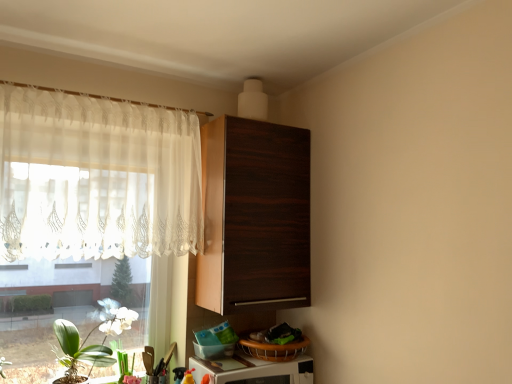
This screenshot has height=384, width=512. What do you see at coordinates (254, 217) in the screenshot?
I see `dark wood cabinet at upper center` at bounding box center [254, 217].

Where is `dark wood cabinet at upper center`? dark wood cabinet at upper center is located at coordinates (254, 217).

What is the approximate width of white glossy microwave at lower center?

13.50 inches.

Describe the element at coordinates (122, 361) in the screenshot. I see `green matte plant at lower left` at that location.

The width and height of the screenshot is (512, 384). In order to click on dark wood cabinet at upper center in this screenshot , I will do `click(254, 217)`.

From the image's perspective, which is above, sheer white curtain at left or white glossy microwave at lower center?

sheer white curtain at left, from the image's perspective.

Is point (42, 160) less distant than point (240, 375)?

Yes, point (42, 160) is closer to viewer.

Choose the correct answer: Is sheer white curtain at left inside white glossy microwave at lower center or outside it?

sheer white curtain at left lies outside white glossy microwave at lower center.

Between sheer white curtain at left and white glossy microwave at lower center, which one is positioned in front?

Result: Positioned in front is sheer white curtain at left.

At what (x,y) coordinates should I click in order to perform the action: click on houseplant located below the sheer white curtain at left (from the image's perspective). Please return your answer as a coordinate pair (x, y). Looking at the image, I should click on (78, 353).

From a real-world perspective, is green leafy plant at lower left below sheer white curtain at left?

Correct, in the physical world, green leafy plant at lower left is lower than sheer white curtain at left.

Could you tell me if green leafy plant at lower left is turned towards sheer white curtain at left?

No, green leafy plant at lower left is not aimed at sheer white curtain at left.

Is point (229, 133) closer or farther from the camera than point (120, 344)?

Point (229, 133) is closer to the camera than point (120, 344).

Is dark wood cabinet at upper center to the left or to the right of green matte plant at lower left in the image?

Based on their positions, dark wood cabinet at upper center is located to the right of green matte plant at lower left.

Can you tell me how much dark wood cabinet at upper center and green matte plant at lower left differ in facing direction?

The facing directions of dark wood cabinet at upper center and green matte plant at lower left are 2.72 degrees apart.

Is dark wood cabinet at upper center situated inside green matte plant at lower left or outside?

dark wood cabinet at upper center is located beyond the bounds of green matte plant at lower left.

Does point (305, 377) lie behind point (247, 216)?

That is True.

Which of these two, white glossy microwave at lower center or dark wood cabinet at upper center, stands taller?

dark wood cabinet at upper center is taller.

Is white glossy microwave at lower center situated inside dark wood cabinet at upper center or outside?

white glossy microwave at lower center cannot be found inside dark wood cabinet at upper center.

Is white glossy microwave at lower center placed right next to dark wood cabinet at upper center?

white glossy microwave at lower center is not next to dark wood cabinet at upper center, and they're not touching.

Looking at the image, does sheer white curtain at left seem bigger or smaller compared to dark wood cabinet at upper center?

Considering their sizes, sheer white curtain at left takes up less space than dark wood cabinet at upper center.

From a real-world perspective, who is located lower, sheer white curtain at left or dark wood cabinet at upper center?

dark wood cabinet at upper center.

Which of these two, sheer white curtain at left or dark wood cabinet at upper center, stands taller?

dark wood cabinet at upper center.

Is dark wood cabinet at upper center smaller than sheer white curtain at left?

Incorrect, dark wood cabinet at upper center is not smaller in size than sheer white curtain at left.

Does dark wood cabinet at upper center have a lesser width compared to sheer white curtain at left?

No, dark wood cabinet at upper center is not thinner than sheer white curtain at left.

Where is `curtain on the left of dark wood cabinet at upper center`? This screenshot has width=512, height=384. curtain on the left of dark wood cabinet at upper center is located at coordinates (96, 177).

Is dark wood cabinet at upper center oriented away from sheer white curtain at left?

No.

Is green matte plant at lower left in front of or behind sheer white curtain at left in the image?

green matte plant at lower left is positioned farther from the viewer than sheer white curtain at left.

Is green matte plant at lower left placed right next to sheer white curtain at left?

No, green matte plant at lower left is not making contact with sheer white curtain at left.

In order to click on curtain on the left of the green matte plant at lower left in this screenshot , I will do `click(96, 177)`.

Consider the image. Which object is positioned more to the left, green matte plant at lower left or sheer white curtain at left?

sheer white curtain at left is more to the left.

Where is `curtain in front of the white glossy microwave at lower center`? curtain in front of the white glossy microwave at lower center is located at coordinates (96, 177).

Identify the location of curtain on the right side of green leafy plant at lower left. (96, 177).

Based on their spatial positions, is sheer white curtain at left or green matte plant at lower left further from green leafy plant at lower left?

Among the two, sheer white curtain at left is located further to green leafy plant at lower left.

Estimate the real-world distances between objects in this image. Which object is closer to green matte plant at lower left, white glossy microwave at lower center or sheer white curtain at left?

The object closer to green matte plant at lower left is white glossy microwave at lower center.

When comparing their distances from white glossy microwave at lower center, does sheer white curtain at left or green leafy plant at lower left seem further?

The object further to white glossy microwave at lower center is sheer white curtain at left.

Estimate the real-world distances between objects in this image. Which object is closer to green leafy plant at lower left, sheer white curtain at left or dark wood cabinet at upper center?

Among the two, sheer white curtain at left is located nearer to green leafy plant at lower left.

Considering their positions, is white glossy microwave at lower center positioned closer to dark wood cabinet at upper center than sheer white curtain at left?

sheer white curtain at left is positioned closer to the anchor dark wood cabinet at upper center.

From the image, which object appears to be farther from green matte plant at lower left, sheer white curtain at left or green leafy plant at lower left?

Among the two, sheer white curtain at left is located further to green matte plant at lower left.

Consider the image. Based on their spatial positions, is green leafy plant at lower left or dark wood cabinet at upper center closer to sheer white curtain at left?

dark wood cabinet at upper center.

From the picture: When comparing their distances from green matte plant at lower left, does dark wood cabinet at upper center or green leafy plant at lower left seem closer?

The object closer to green matte plant at lower left is green leafy plant at lower left.

Find the location of a particular element. cabinetry between sheer white curtain at left and white glossy microwave at lower center in the up-down direction is located at coordinates (254, 217).

The width and height of the screenshot is (512, 384). Identify the location of plant between green leafy plant at lower left and white glossy microwave at lower center from left to right. (122, 361).

This screenshot has width=512, height=384. In order to click on cabinetry that lies between sheer white curtain at left and green matte plant at lower left from top to bottom in this screenshot , I will do `click(254, 217)`.

This screenshot has height=384, width=512. In order to click on plant between dark wood cabinet at upper center and white glossy microwave at lower center from top to bottom in this screenshot , I will do `click(122, 361)`.